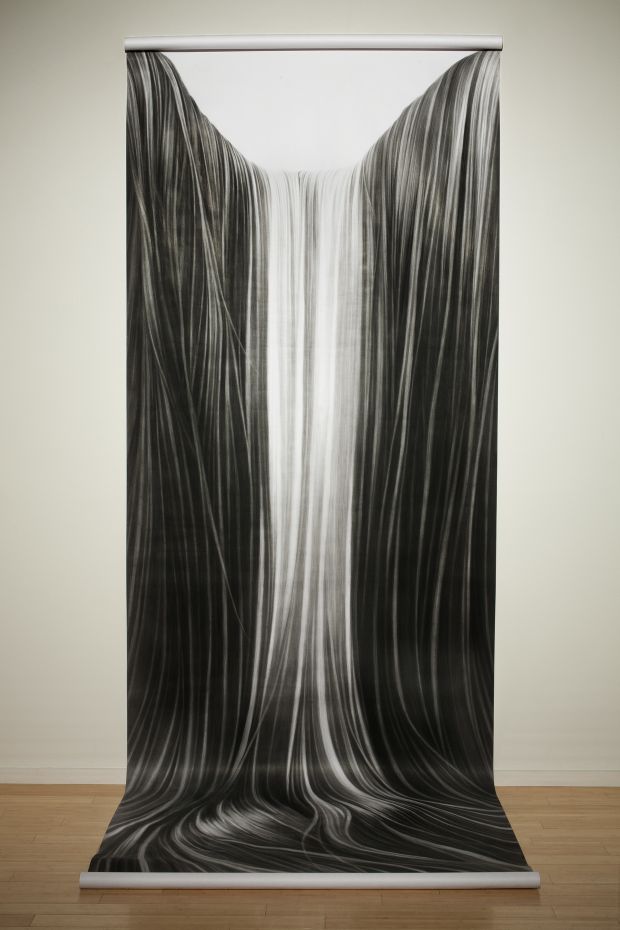
At what (x,y) coordinates should I click in order to perform the action: click on white wall on right side of fabric. Please return your answer as a coordinate pair (x, y). The width and height of the screenshot is (620, 930). Looking at the image, I should click on (539, 442).